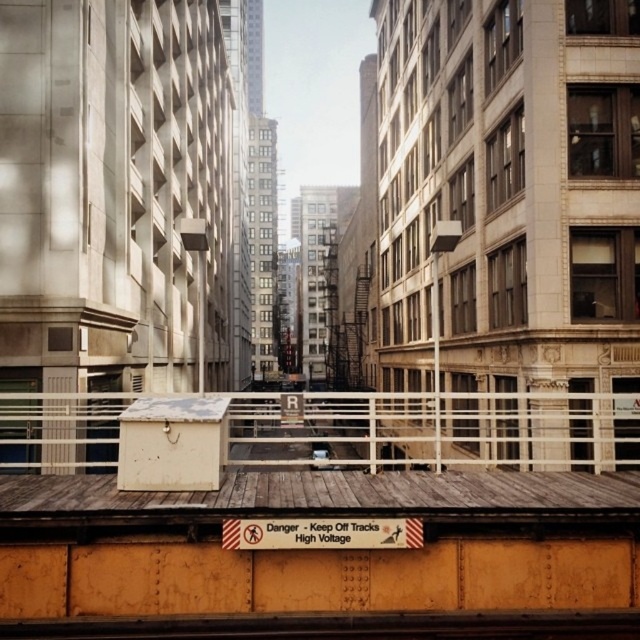
Consider the image. You are a pedestrian trying to cross this alleyway. You see the white metal rail at center and the smooth steel train track at bottom center. Which object is closer to you as you stand at the entrance of the alleyway?

The white metal rail at center is closer to you because it is positioned further to the viewer than the smooth steel train track at bottom center.

In the scene shown: You are a maintenance worker needing to access the smooth steel train track at bottom center. You see the white metal rail at center nearby. Which object is taller and must be navigated around to reach the track?

The white metal rail at center is taller than the smooth steel train track at bottom center, so you must navigate around it to reach the track.